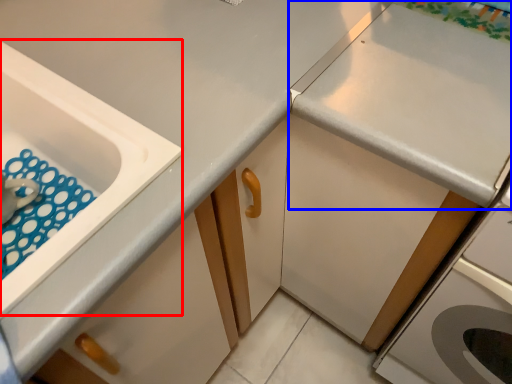
Question: Which point is further to the camera, sink (highlighted by a red box) or countertop (highlighted by a blue box)?

Choices:
 (A) sink
 (B) countertop

Answer: (B)